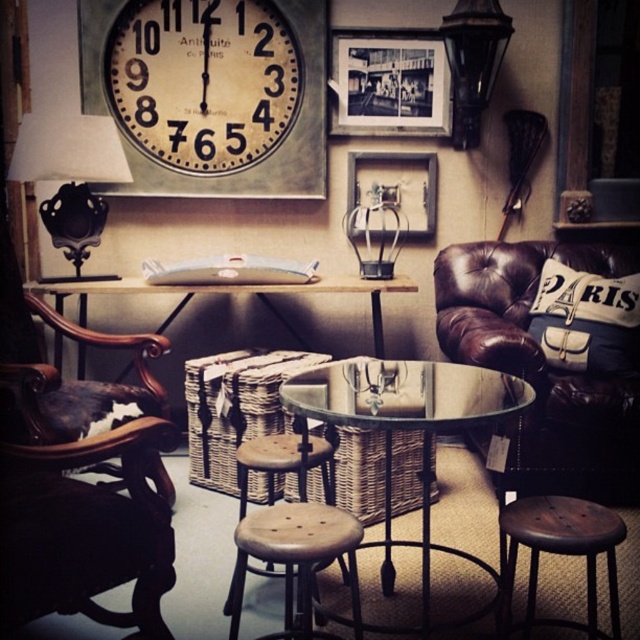
You are standing in the vintage interior space and want to place a small decoration between the two points labeled as point (x=596, y=384) and point (x=272, y=449). Considering their positions, which point should the decoration be closer to in order to be more visible from your current viewpoint?

The decoration should be placed closer to point (x=596, y=384) because it is closer to the camera, making it more visible from your current viewpoint.

You are a customer in this vintage space and want to sit down. You see the brown leather swivel chair at upper right and the canvas paris pillow at right. Which one is larger in size?

The brown leather swivel chair at upper right is bigger than the canvas paris pillow at right, so the brown leather swivel chair at upper right is larger in size.